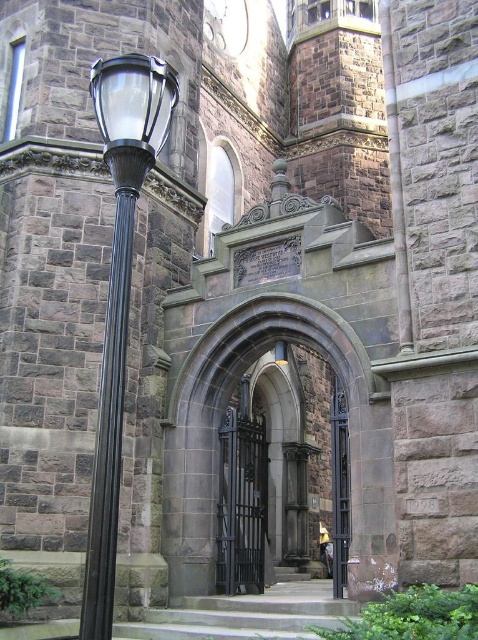
How far apart are matte black lamp post at left and black polished metal pole at left?

matte black lamp post at left is 78.35 centimeters away from black polished metal pole at left.

Is matte black lamp post at left above black polished metal pole at left?

Indeed, matte black lamp post at left is positioned over black polished metal pole at left.

I want to click on matte black lamp post at left, so click(x=119, y=296).

The height and width of the screenshot is (640, 478). I want to click on matte black lamp post at left, so click(x=119, y=296).

What do you see at coordinates (108, 432) in the screenshot?
I see `black polished metal pole at left` at bounding box center [108, 432].

Can you confirm if black polished metal pole at left is positioned to the left of black wrought iron gate at center?

Indeed, black polished metal pole at left is positioned on the left side of black wrought iron gate at center.

You are a GUI agent. You are given a task and a screenshot of the screen. Output one action in this format:
    pyautogui.click(x=<x>, y=<y>)
    Task: Click on the black polished metal pole at left
    The image size is (478, 640).
    Given the screenshot: What is the action you would take?
    pyautogui.click(x=108, y=432)

Does black polished metal pole at left appear on the right side of polished dark wood door at center?

In fact, black polished metal pole at left is to the left of polished dark wood door at center.

Can you confirm if black polished metal pole at left is positioned below polished dark wood door at center?

No.

Which is behind, point (115, 340) or point (337, 554)?

The point (337, 554) is more distant.

Locate an element on the screen. This screenshot has height=640, width=478. black polished metal pole at left is located at coordinates (108, 432).